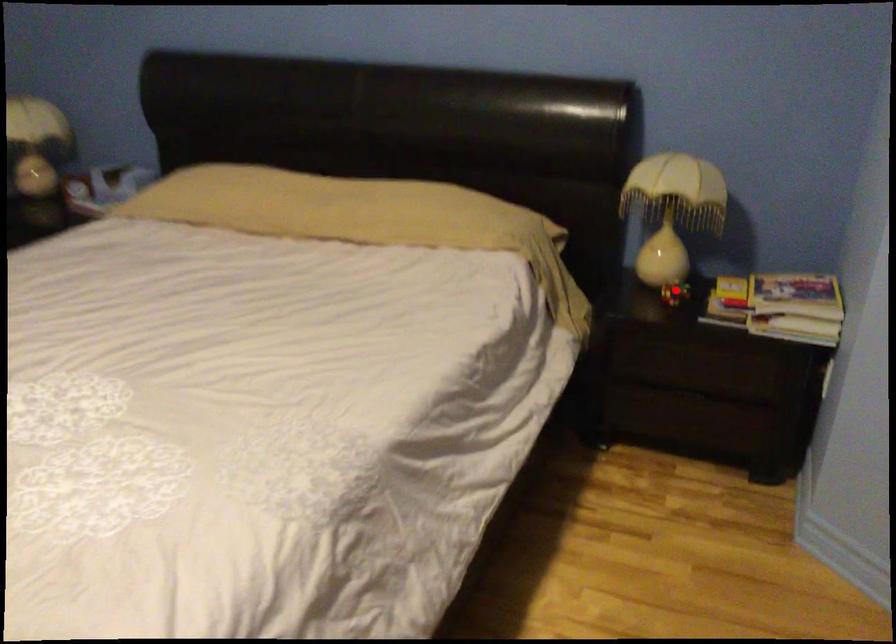
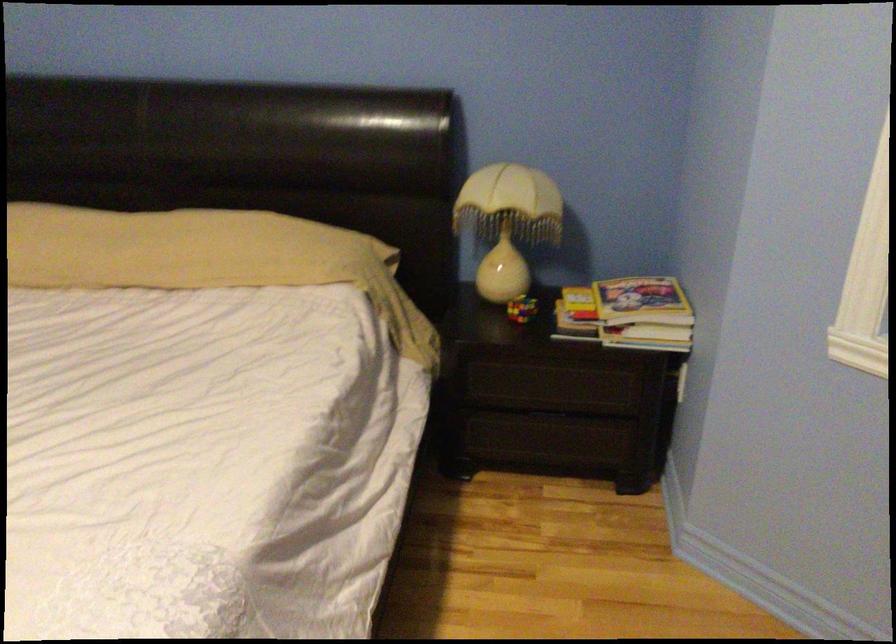
Find the pixel in the second image that matches the highlighted location in the first image.

(521, 308)